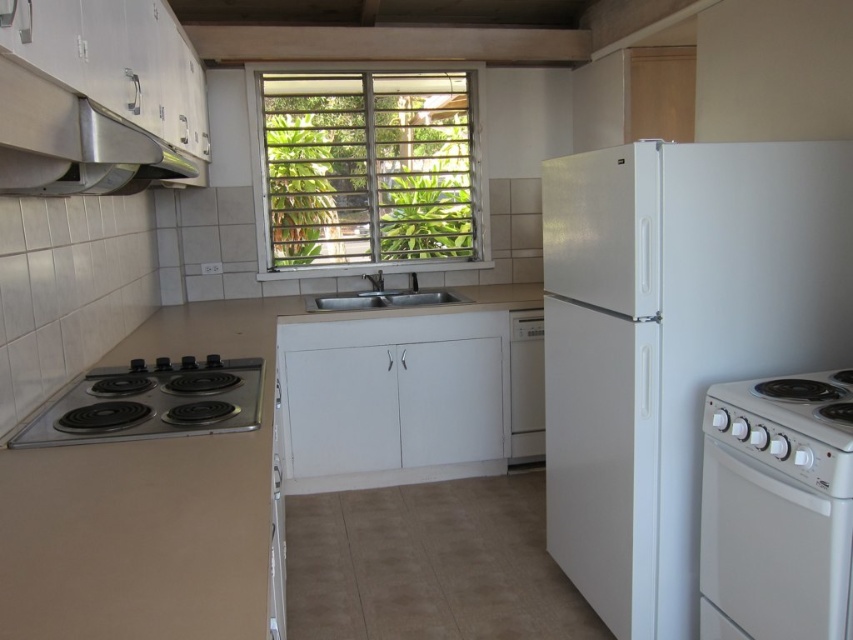
Question: Can you confirm if white glossy refrigerator at right is thinner than white glossy electric stove at lower right?

Choices:
 (A) yes
 (B) no

Answer: (B)

Question: Which object appears farthest from the camera in this image?

Choices:
 (A) white textured window at center
 (B) white glossy electric stove at lower right
 (C) stainless steel exhaust hood at upper left
 (D) white matte sink at center

Answer: (A)

Question: Can you confirm if white textured window at center is smaller than white glossy electric stove at lower right?

Choices:
 (A) no
 (B) yes

Answer: (A)

Question: Is white glossy refrigerator at right closer to the viewer compared to white matte sink at center?

Choices:
 (A) yes
 (B) no

Answer: (A)

Question: Considering the real-world distances, which object is farthest from the black glass stove at lower left?

Choices:
 (A) white glossy refrigerator at right
 (B) white matte sink at center
 (C) white textured window at center

Answer: (C)

Question: Among these objects, which one is farthest from the camera?

Choices:
 (A) white plastic dishwasher at center
 (B) white textured window at center

Answer: (B)